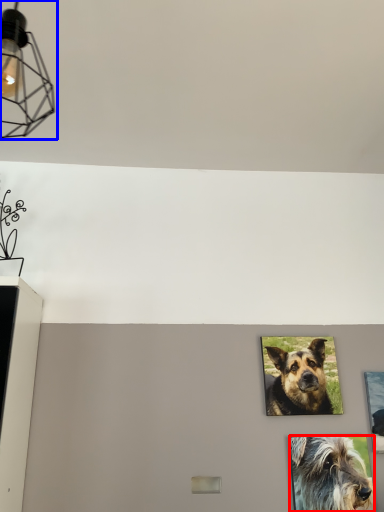
Question: Which object appears farthest to the camera in this image, dog (highlighted by a red box) or light fixture (highlighted by a blue box)?

Choices:
 (A) dog
 (B) light fixture

Answer: (A)